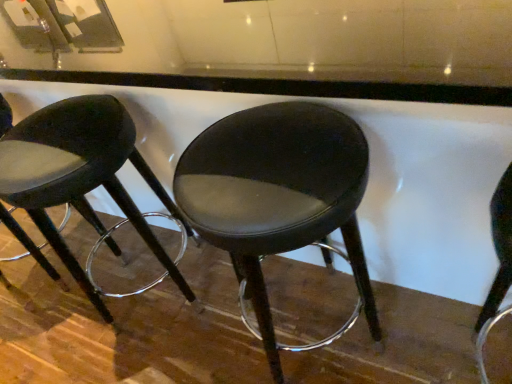
Question: Is matte black stool at center, the second stool in the right-to-left sequence, looking in the opposite direction of black leather stool at center, the 1th stool when ordered from right to left?

Choices:
 (A) no
 (B) yes

Answer: (A)

Question: Does matte black stool at center, which is the 1th stool from left to right, appear on the right side of black leather stool at center, the 2th stool in the left-to-right sequence?

Choices:
 (A) yes
 (B) no

Answer: (B)

Question: Is the position of matte black stool at center, the second stool in the right-to-left sequence, less distant than that of black leather stool at center, the 1th stool when ordered from right to left?

Choices:
 (A) yes
 (B) no

Answer: (B)

Question: Does matte black stool at center, which is the 1th stool from left to right, have a greater width compared to black leather stool at center, the 2th stool in the left-to-right sequence?

Choices:
 (A) yes
 (B) no

Answer: (A)

Question: Does matte black stool at center, the second stool in the right-to-left sequence, have a lesser width compared to black leather stool at center, the 1th stool when ordered from right to left?

Choices:
 (A) yes
 (B) no

Answer: (B)

Question: From a real-world perspective, is matte black stool at center, which is the 1th stool from left to right, over black leather stool at center, the 1th stool when ordered from right to left?

Choices:
 (A) no
 (B) yes

Answer: (B)

Question: From a real-world perspective, does black leather stool at center, the 1th stool when ordered from right to left, sit lower than matte black stool at center, which is the 1th stool from left to right?

Choices:
 (A) yes
 (B) no

Answer: (A)

Question: Does black leather stool at center, the 1th stool when ordered from right to left, have a greater width compared to matte black stool at center, which is the 1th stool from left to right?

Choices:
 (A) yes
 (B) no

Answer: (B)

Question: Does black leather stool at center, the 1th stool when ordered from right to left, have a smaller size compared to matte black stool at center, which is the 1th stool from left to right?

Choices:
 (A) no
 (B) yes

Answer: (B)

Question: Considering the relative positions of black leather stool at center, the 2th stool in the left-to-right sequence, and matte black stool at center, which is the 1th stool from left to right, in the image provided, is black leather stool at center, the 2th stool in the left-to-right sequence, to the left of matte black stool at center, which is the 1th stool from left to right, from the viewer's perspective?

Choices:
 (A) yes
 (B) no

Answer: (B)

Question: Considering the relative sizes of black leather stool at center, the 1th stool when ordered from right to left, and matte black stool at center, which is the 1th stool from left to right, in the image provided, is black leather stool at center, the 1th stool when ordered from right to left, shorter than matte black stool at center, which is the 1th stool from left to right,?

Choices:
 (A) yes
 (B) no

Answer: (B)

Question: Is black leather stool at center, the 1th stool when ordered from right to left, aimed at matte black stool at center, which is the 1th stool from left to right?

Choices:
 (A) yes
 (B) no

Answer: (B)

Question: Based on their sizes in the image, would you say matte black stool at center, the second stool in the right-to-left sequence, is bigger or smaller than black leather stool at center, the 2th stool in the left-to-right sequence?

Choices:
 (A) big
 (B) small

Answer: (A)